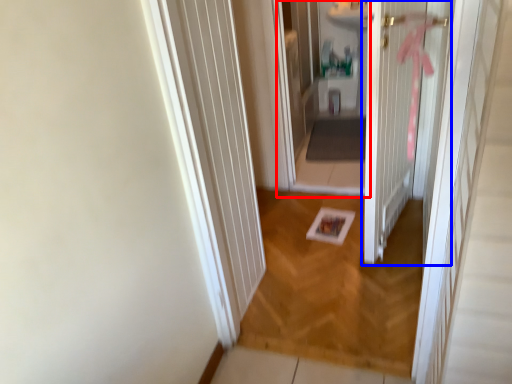
Question: Which object appears closest to the camera in this image, corridor (highlighted by a red box) or door (highlighted by a blue box)?

Choices:
 (A) corridor
 (B) door

Answer: (B)